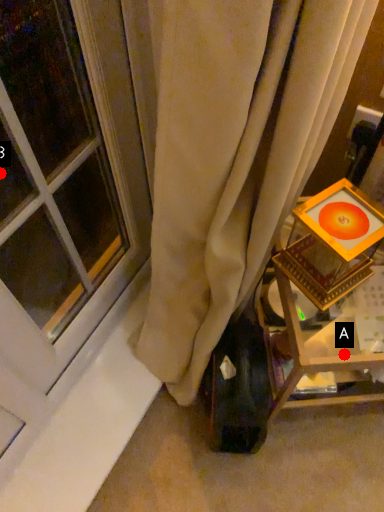
Question: Two points are circled on the image, labeled by A and B beside each circle. Among these points, which one is nearest to the camera?

Choices:
 (A) A is closer
 (B) B is closer

Answer: (A)